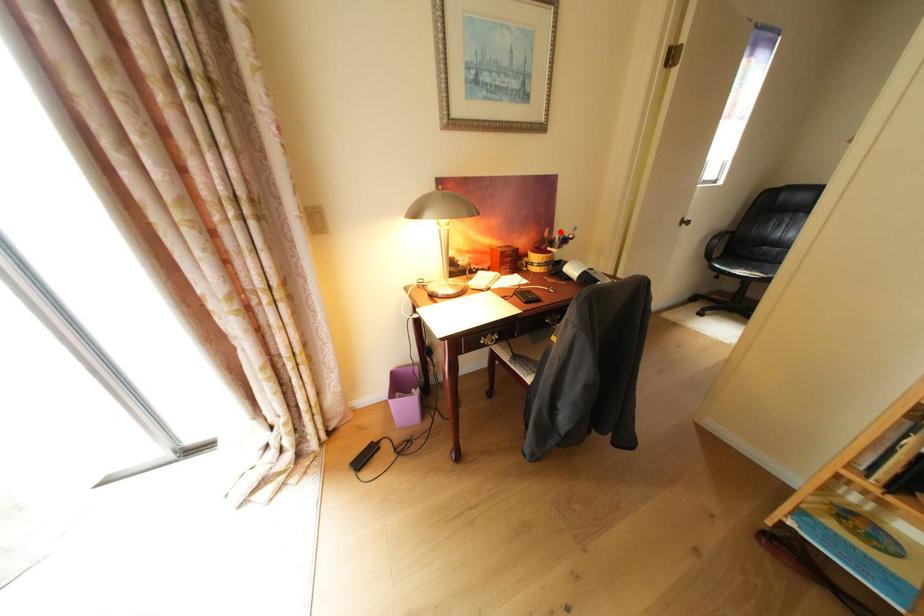
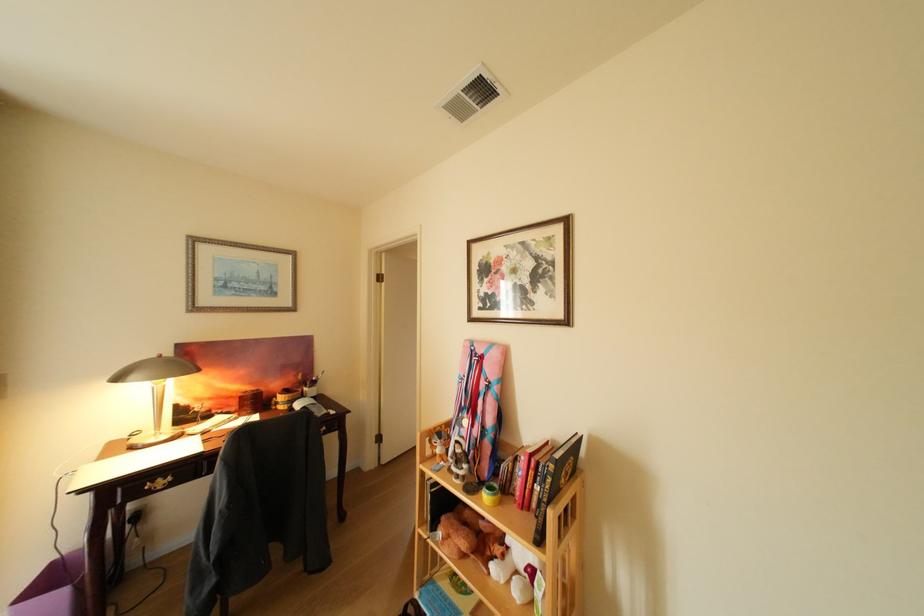
Question: I am providing you with two images of the same scene from different viewpoints. A red point is marked on the first image. Is the red point's position out of view in image 2?

Choices:
 (A) Yes
 (B) No

Answer: (B)